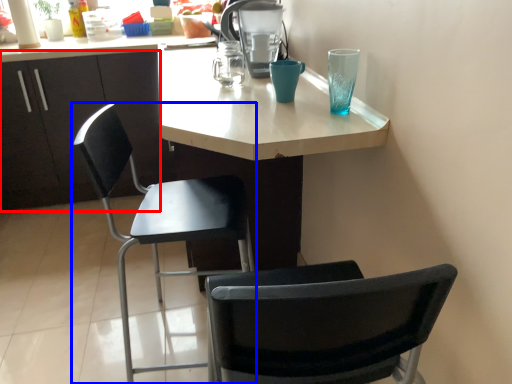
Question: Which object appears closest to the camera in this image, cabinetry (highlighted by a red box) or chair (highlighted by a blue box)?

Choices:
 (A) cabinetry
 (B) chair

Answer: (B)